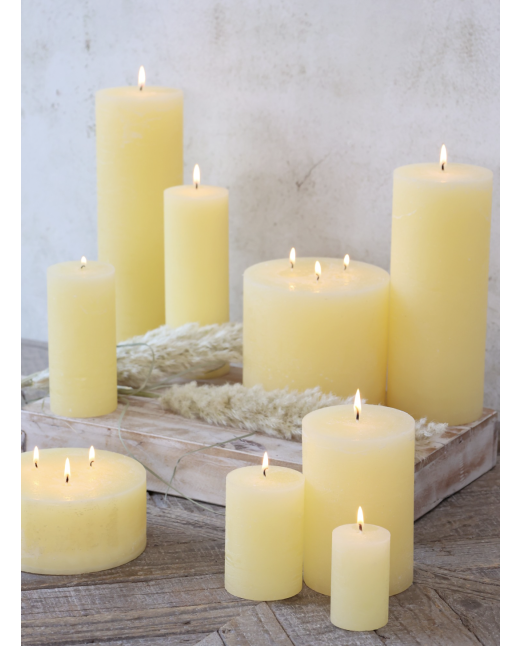
I want to click on candles on right side of image, so click(x=334, y=325), click(x=471, y=306), click(x=381, y=444), click(x=262, y=526), click(x=373, y=576).